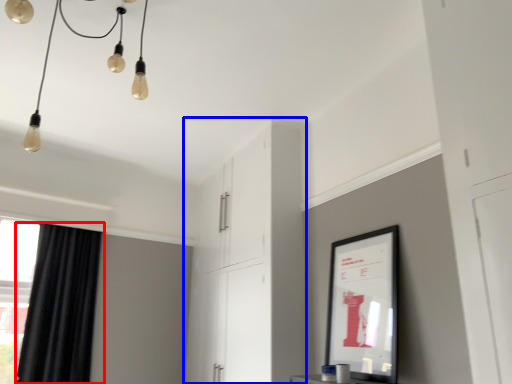
Question: Which object is closer to the camera taking this photo, curtain (highlighted by a red box) or dresser (highlighted by a blue box)?

Choices:
 (A) curtain
 (B) dresser

Answer: (B)